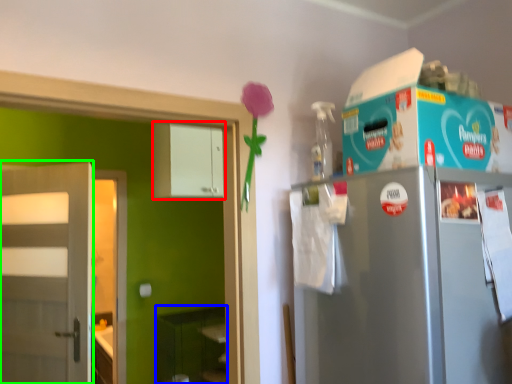
Question: Which object is positioned farthest from cabinetry (highlighted by a red box)? Select from shelf (highlighted by a blue box) and door (highlighted by a green box).

Choices:
 (A) shelf
 (B) door

Answer: (A)